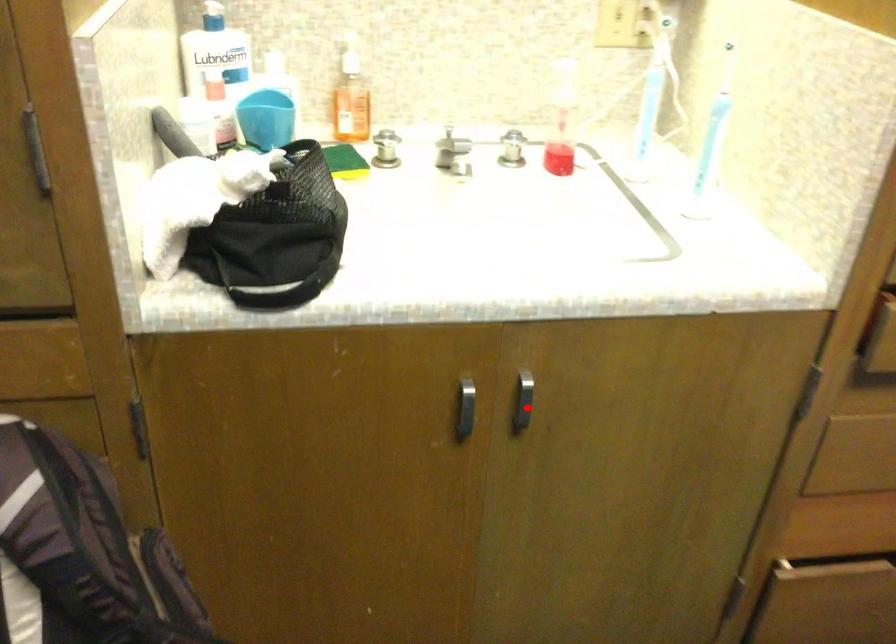
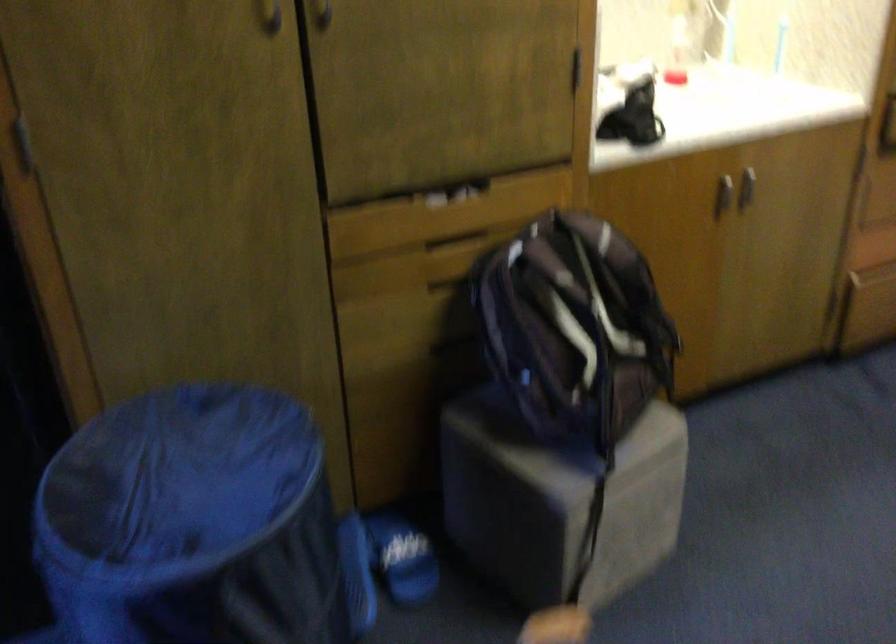
Question: I am providing you with two images of the same scene from different viewpoints. A red point is marked on the first image. Can you still see the location of the red point in image 2?

Choices:
 (A) Yes
 (B) No

Answer: (A)